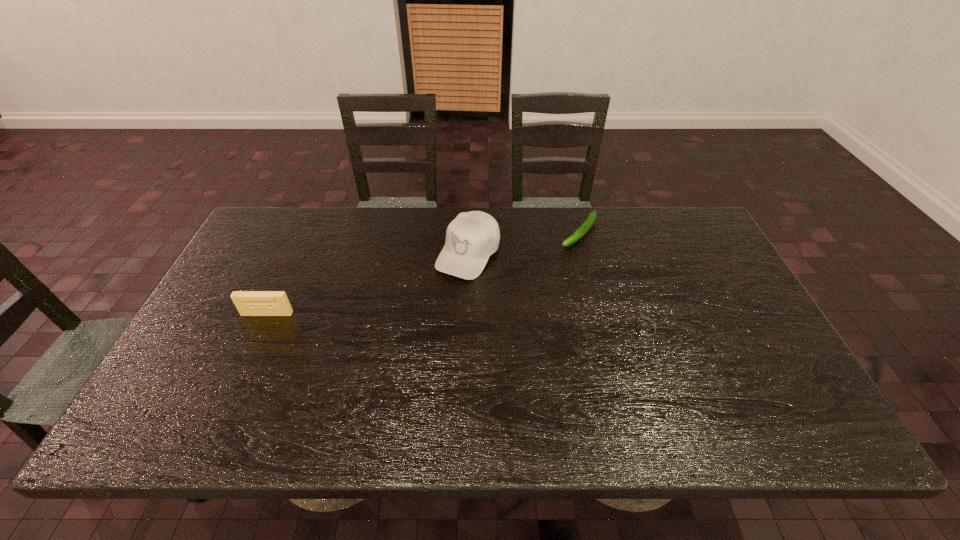
I want to click on vacant space on the desktop that is between the third shortest object and the watch and is positioned on the front-facing side of the baseball cap, so click(419, 321).

This screenshot has width=960, height=540. Find the location of `vacant space on the desktop that is between the leftmost object and the watch and is positioned on the front-facing side of the zucchini`. vacant space on the desktop that is between the leftmost object and the watch and is positioned on the front-facing side of the zucchini is located at coordinates (492, 323).